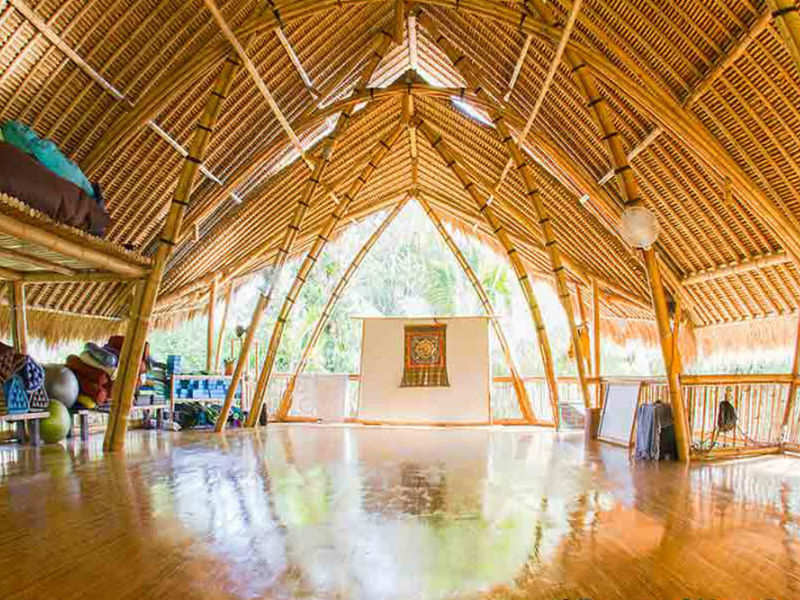
I want to click on exercise ball, so click(x=54, y=422), click(x=61, y=390).